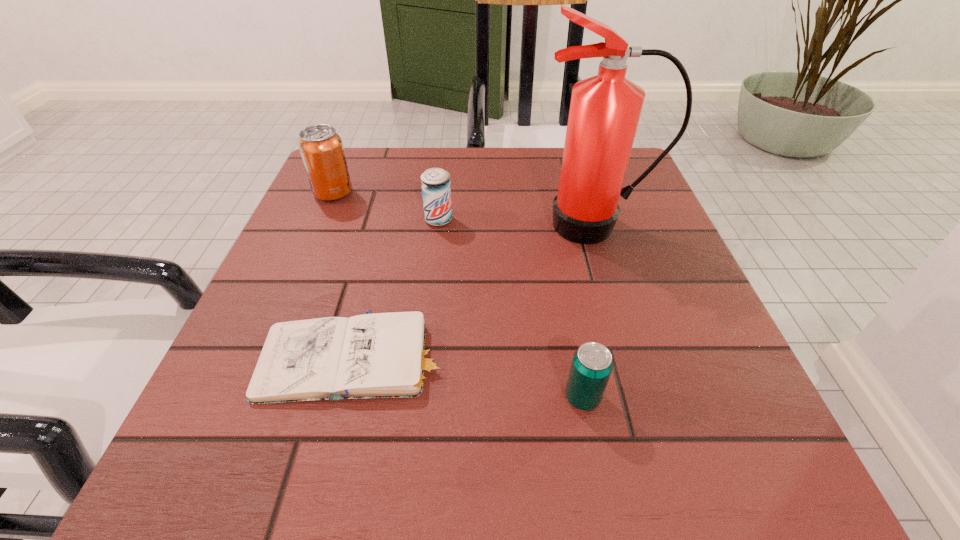
You are a GUI agent. You are given a task and a screenshot of the screen. Output one action in this format:
    pyautogui.click(x=<x>, y=<y>)
    Task: Click on the vacant space situated 0.110m on the front of the notebook
    The height and width of the screenshot is (540, 960).
    Given the screenshot: What is the action you would take?
    pyautogui.click(x=323, y=493)

This screenshot has height=540, width=960. I want to click on object that is at the far edge, so click(x=321, y=148).

You are a GUI agent. You are given a task and a screenshot of the screen. Output one action in this format:
    pyautogui.click(x=<x>, y=<y>)
    Task: Click on the soda can at the left edge
    
    Given the screenshot: What is the action you would take?
    pyautogui.click(x=321, y=148)

Locate an element on the screen. The image size is (960, 540). notebook at the left edge is located at coordinates (383, 355).

You are a GUI agent. You are given a task and a screenshot of the screen. Output one action in this format:
    pyautogui.click(x=<x>, y=<y>)
    Task: Click on the object located at the right edge
    
    Given the screenshot: What is the action you would take?
    pyautogui.click(x=604, y=112)

The width and height of the screenshot is (960, 540). I want to click on object positioned at the far left corner, so click(x=321, y=148).

Find the location of `vacant space at the far edge of the desktop`. vacant space at the far edge of the desktop is located at coordinates (400, 152).

This screenshot has width=960, height=540. What are the coordinates of `vacant region at the left edge of the desktop` in the screenshot? It's located at (344, 292).

Find the location of a particular element. Image resolution: width=960 pixels, height=540 pixels. vacant space at the right edge of the desktop is located at coordinates (671, 315).

Locate an element on the screen. vacant space at the near left corner of the desktop is located at coordinates 195,482.